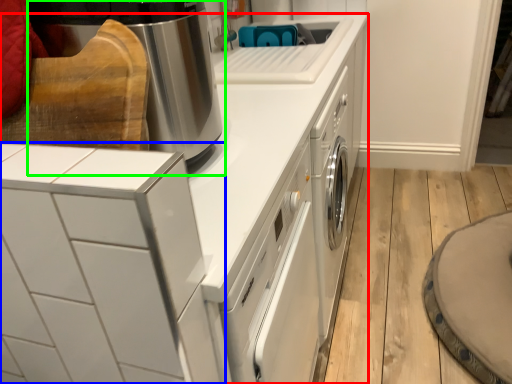
Question: Estimate the real-world distances between objects in this image. Which object is closer to home appliance (highlighted by a red box), home appliance (highlighted by a blue box) or home appliance (highlighted by a green box)?

Choices:
 (A) home appliance
 (B) home appliance

Answer: (A)